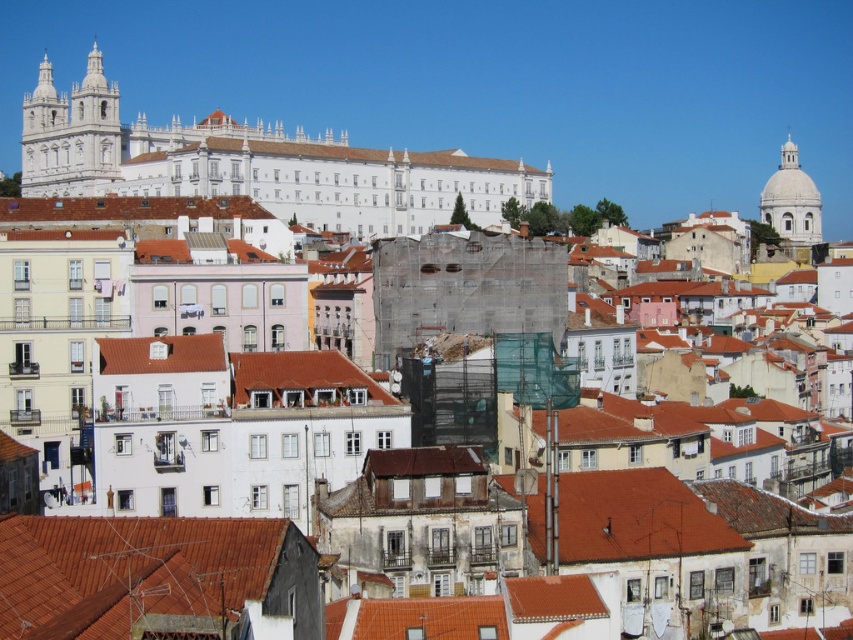
You are an architect analyzing the urban layout. Given the white marble tower at upper left and the white smooth building at center, which one has a smaller width according to the architectural plans?

The white marble tower at upper left has a smaller width than the white smooth building at center.

You are a tourist standing in the city square and want to take a photo that includes both the white marble tower at upper left and the white smooth building at center. Which direction should you face to ensure both are visible in your frame?

You should face towards the right side of the white marble tower at upper left so that both it and the white smooth building at center are visible in your frame since the white marble tower at upper left is positioned to the left of the white smooth building at center.

You are a tourist standing in the city square and want to take a photo of the white smooth building at center without the white marble tower at upper left blocking the view. Is there a position where you can do this?

The white smooth building at center is behind the white marble tower at upper left, so you cannot take a photo of the white smooth building at center without the white marble tower at upper left blocking the view from any position in the city square.